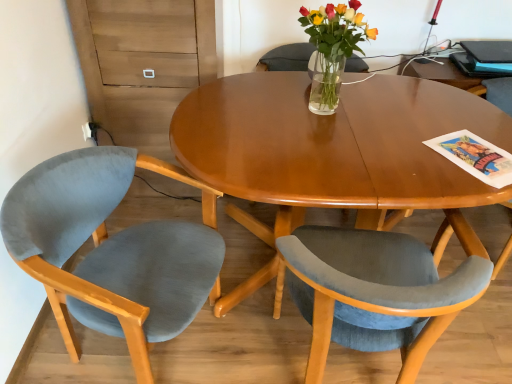
The height and width of the screenshot is (384, 512). What do you see at coordinates (109, 251) in the screenshot?
I see `velvet blue chair at left, the 3th chair in the right-to-left sequence` at bounding box center [109, 251].

Image resolution: width=512 pixels, height=384 pixels. What do you see at coordinates (332, 49) in the screenshot? I see `clear glass vase at center` at bounding box center [332, 49].

Where is `blue glossy magazine at upper right`? blue glossy magazine at upper right is located at coordinates (472, 67).

This screenshot has width=512, height=384. What do you see at coordinates (472, 67) in the screenshot?
I see `blue glossy magazine at upper right` at bounding box center [472, 67].

What do you see at coordinates (489, 51) in the screenshot? The height and width of the screenshot is (384, 512). I see `black plastic laptop at upper right` at bounding box center [489, 51].

Identify the location of velvet blue chair at center, which ranks as the second chair in right-to-left order. (374, 290).

Where is `clear glass vase at center`? The height and width of the screenshot is (384, 512). clear glass vase at center is located at coordinates (325, 83).

What do you see at coordinates (325, 83) in the screenshot? This screenshot has height=384, width=512. I see `clear glass vase at center` at bounding box center [325, 83].

Where is `velvet blue chair at right, which ranks as the first chair in right-to-left order`? The width and height of the screenshot is (512, 384). velvet blue chair at right, which ranks as the first chair in right-to-left order is located at coordinates (496, 93).

Considering the positions of objects blue glossy magazine at upper right and velvet blue chair at right, placed as the 3th chair when sorted from left to right, in the image provided, who is in front, blue glossy magazine at upper right or velvet blue chair at right, placed as the 3th chair when sorted from left to right,?

velvet blue chair at right, placed as the 3th chair when sorted from left to right.

I want to click on the 1st chair counting from the left side of the blue glossy magazine at upper right, so click(496, 93).

From a real-world perspective, is blue glossy magazine at upper right below velvet blue chair at right, placed as the 3th chair when sorted from left to right?

No, from a real-world perspective, blue glossy magazine at upper right is not below velvet blue chair at right, placed as the 3th chair when sorted from left to right.

Are velvet blue chair at left, the 3th chair in the right-to-left sequence, and clear glass vase at center located far from each other?

No.

Would you say velvet blue chair at left, which is the 1th chair from left to right, contains clear glass vase at center?

No.

Which is more to the left, velvet blue chair at left, which is the 1th chair from left to right, or clear glass vase at center?

From the viewer's perspective, velvet blue chair at left, which is the 1th chair from left to right, appears more on the left side.

Does velvet blue chair at left, which is the 1th chair from left to right, have a smaller size compared to clear glass vase at center?

No.

Is velvet blue chair at left, the 3th chair in the right-to-left sequence, located outside blue glossy magazine at upper right?

That's correct, velvet blue chair at left, the 3th chair in the right-to-left sequence, is outside of blue glossy magazine at upper right.

Identify the location of chair that is the 3rd object directly below the blue glossy magazine at upper right (from a real-world perspective). This screenshot has width=512, height=384. (109, 251).

Between velvet blue chair at left, the 3th chair in the right-to-left sequence, and blue glossy magazine at upper right, which one has larger size?

Bigger between the two is velvet blue chair at left, the 3th chair in the right-to-left sequence.

Looking at this image, in the image, is velvet blue chair at left, which is the 1th chair from left to right, on the left side or the right side of blue glossy magazine at upper right?

From the image, it's evident that velvet blue chair at left, which is the 1th chair from left to right, is to the left of blue glossy magazine at upper right.

Is the position of velvet blue chair at center, which ranks as the second chair in right-to-left order, more distant than that of clear glass vase at center?

No, the depth of velvet blue chair at center, which ranks as the second chair in right-to-left order, is less than that of clear glass vase at center.

Is velvet blue chair at center, which ranks as the second chair in right-to-left order, positioned beyond the bounds of clear glass vase at center?

Indeed, velvet blue chair at center, which ranks as the second chair in right-to-left order, is completely outside clear glass vase at center.

Consider the image. From the image's perspective, which object appears higher, velvet blue chair at center, which ranks as the second chair in right-to-left order, or clear glass vase at center?

clear glass vase at center appears higher in the image.

Is point (386, 270) positioned in front of point (323, 66)?

Yes, point (386, 270) is in front of point (323, 66).

In terms of height, does clear glass vase at center look taller or shorter compared to blue glossy magazine at upper right?

In the image, clear glass vase at center appears to be taller than blue glossy magazine at upper right.

Does clear glass vase at center appear on the left side of blue glossy magazine at upper right?

Correct, you'll find clear glass vase at center to the left of blue glossy magazine at upper right.

From the image's perspective, would you say clear glass vase at center is shown under blue glossy magazine at upper right?

Yes, from the image's perspective, clear glass vase at center is beneath blue glossy magazine at upper right.

Is clear glass vase at center positioned with its back to blue glossy magazine at upper right?

No, clear glass vase at center's orientation is not away from blue glossy magazine at upper right.

In terms of size, does velvet blue chair at right, which ranks as the first chair in right-to-left order, appear bigger or smaller than blue glossy magazine at upper right?

Clearly, velvet blue chair at right, which ranks as the first chair in right-to-left order, is larger in size than blue glossy magazine at upper right.

Is blue glossy magazine at upper right inside velvet blue chair at right, which ranks as the first chair in right-to-left order?

Actually, blue glossy magazine at upper right is outside velvet blue chair at right, which ranks as the first chair in right-to-left order.

Measure the distance between velvet blue chair at right, placed as the 3th chair when sorted from left to right, and blue glossy magazine at upper right.

The distance of velvet blue chair at right, placed as the 3th chair when sorted from left to right, from blue glossy magazine at upper right is 11.99 centimeters.

Does velvet blue chair at right, which ranks as the first chair in right-to-left order, appear on the right side of blue glossy magazine at upper right?

In fact, velvet blue chair at right, which ranks as the first chair in right-to-left order, is to the left of blue glossy magazine at upper right.

How far apart are clear glass vase at center and clear glass vase at center?

They are 2.18 inches apart.

Who is bigger, clear glass vase at center or clear glass vase at center?

Bigger between the two is clear glass vase at center.

Considering the relative sizes of clear glass vase at center and clear glass vase at center in the image provided, is clear glass vase at center wider than clear glass vase at center?

In fact, clear glass vase at center might be narrower than clear glass vase at center.

Could you tell me if clear glass vase at center is facing clear glass vase at center?

Yes, clear glass vase at center is turned towards clear glass vase at center.

Where is `magazine above the velvet blue chair at right, which ranks as the first chair in right-to-left order (from the image's perspective)`? This screenshot has height=384, width=512. magazine above the velvet blue chair at right, which ranks as the first chair in right-to-left order (from the image's perspective) is located at coordinates (472, 67).

This screenshot has width=512, height=384. What are the coordinates of `vase that appears behind the velvet blue chair at left, which is the 1th chair from left to right` in the screenshot? It's located at (325, 83).

Based on their spatial positions, is velvet blue chair at center, which ranks as the second chair in right-to-left order, or velvet blue chair at right, placed as the 3th chair when sorted from left to right, further from clear glass vase at center?

velvet blue chair at right, placed as the 3th chair when sorted from left to right, is positioned further to the anchor clear glass vase at center.

When comparing their distances from clear glass vase at center, does blue glossy magazine at upper right or velvet blue chair at center, which appears as the second chair when viewed from the left, seem further?

blue glossy magazine at upper right.

Which object lies nearer to the anchor point velvet blue chair at right, which ranks as the first chair in right-to-left order, velvet blue chair at left, which is the 1th chair from left to right, or velvet blue chair at center, which ranks as the second chair in right-to-left order?

The object closer to velvet blue chair at right, which ranks as the first chair in right-to-left order, is velvet blue chair at center, which ranks as the second chair in right-to-left order.

When comparing their distances from velvet blue chair at left, which is the 1th chair from left to right, does black plastic laptop at upper right or clear glass vase at center seem further?

Based on the image, black plastic laptop at upper right appears to be further to velvet blue chair at left, which is the 1th chair from left to right.

From the image, which object appears to be farther from velvet blue chair at left, the 3th chair in the right-to-left sequence, velvet blue chair at center, which appears as the second chair when viewed from the left, or clear glass vase at center?

Based on the image, clear glass vase at center appears to be further to velvet blue chair at left, the 3th chair in the right-to-left sequence.

Which object lies nearer to the anchor point velvet blue chair at center, which appears as the second chair when viewed from the left, clear glass vase at center or velvet blue chair at left, which is the 1th chair from left to right?

Based on the image, velvet blue chair at left, which is the 1th chair from left to right, appears to be nearer to velvet blue chair at center, which appears as the second chair when viewed from the left.

When comparing their distances from velvet blue chair at left, the 3th chair in the right-to-left sequence, does blue glossy magazine at upper right or velvet blue chair at center, which appears as the second chair when viewed from the left, seem closer?

Among the two, velvet blue chair at center, which appears as the second chair when viewed from the left, is located nearer to velvet blue chair at left, the 3th chair in the right-to-left sequence.

Based on the photo, which object lies further to the anchor point clear glass vase at center, velvet blue chair at left, which is the 1th chair from left to right, or velvet blue chair at center, which ranks as the second chair in right-to-left order?

velvet blue chair at left, which is the 1th chair from left to right, is further to clear glass vase at center.

Where is `houseplant located between velvet blue chair at left, which is the 1th chair from left to right, and blue glossy magazine at upper right in the left-right direction`? The height and width of the screenshot is (384, 512). houseplant located between velvet blue chair at left, which is the 1th chair from left to right, and blue glossy magazine at upper right in the left-right direction is located at coordinates (332, 49).

Find the location of a particular element. Image resolution: width=512 pixels, height=384 pixels. vase between velvet blue chair at left, the 3th chair in the right-to-left sequence, and blue glossy magazine at upper right is located at coordinates (325, 83).

At what (x,y) coordinates should I click in order to perform the action: click on houseplant between velvet blue chair at left, which is the 1th chair from left to right, and black plastic laptop at upper right. Please return your answer as a coordinate pair (x, y). Looking at the image, I should click on (332, 49).

I want to click on vase between clear glass vase at center and black plastic laptop at upper right in the horizontal direction, so click(x=325, y=83).